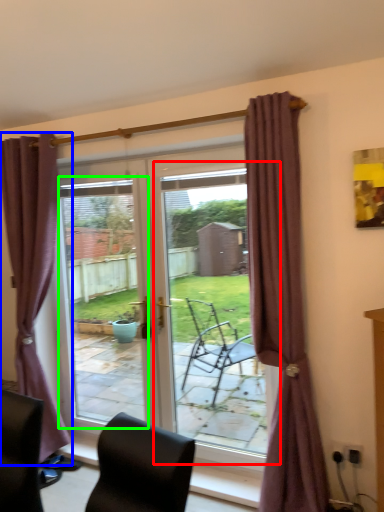
Question: Estimate the real-world distances between objects in this image. Which object is farther from screen door (highlighted by a red box), curtain (highlighted by a blue box) or window screen (highlighted by a green box)?

Choices:
 (A) curtain
 (B) window screen

Answer: (A)